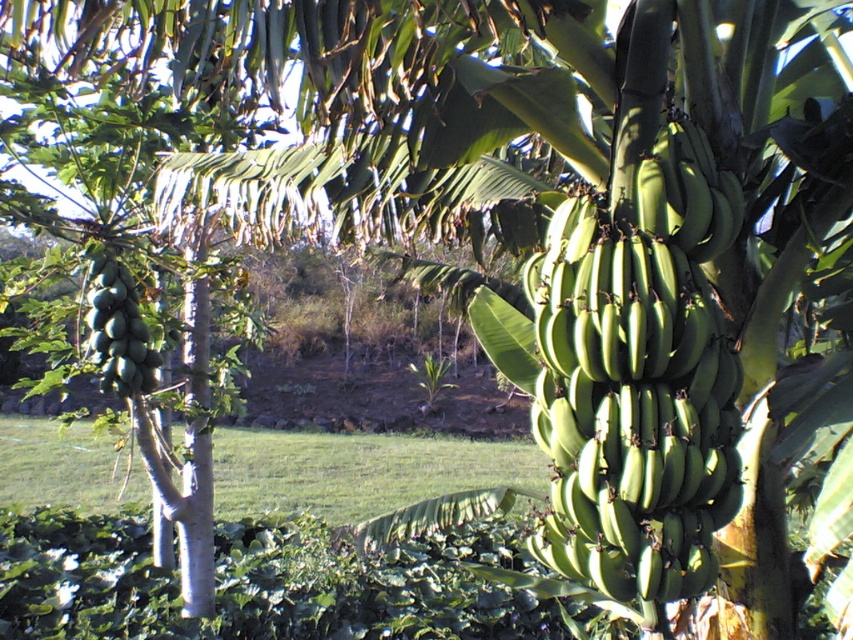
Measure the distance from green matte bananas at center to green matte papaya at left.

The distance of green matte bananas at center from green matte papaya at left is 2.57 meters.

This screenshot has width=853, height=640. What do you see at coordinates (637, 376) in the screenshot?
I see `green matte bananas at center` at bounding box center [637, 376].

Describe the element at coordinates (637, 376) in the screenshot. Image resolution: width=853 pixels, height=640 pixels. I see `green matte bananas at center` at that location.

The image size is (853, 640). I want to click on green matte bananas at center, so click(x=637, y=376).